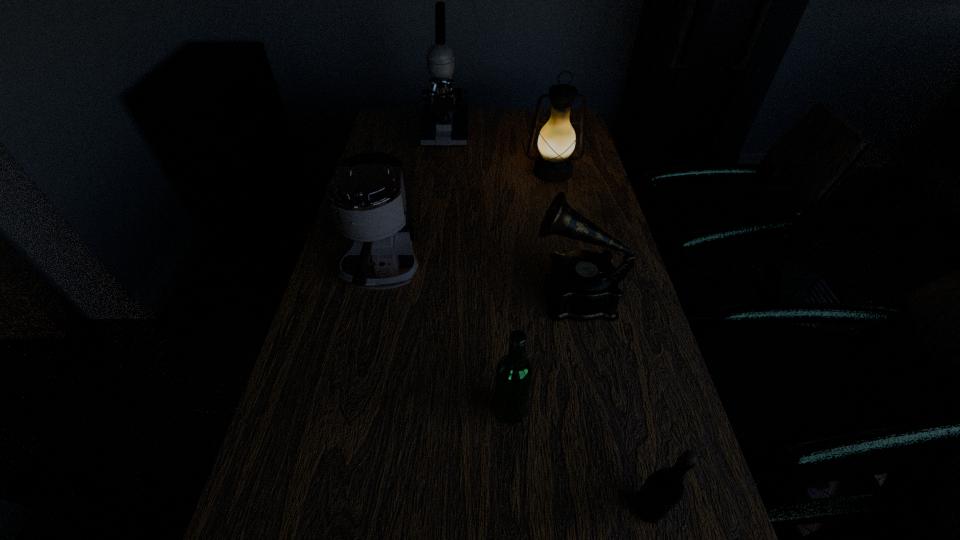
Find the location of a particular element. This screenshot has width=960, height=540. vacant space located 0.060m on the left of the oil lamp is located at coordinates (507, 172).

Image resolution: width=960 pixels, height=540 pixels. In order to click on vacant point located 0.330m on the front-facing side of the coffee maker in this screenshot , I will do [340, 467].

Find the location of a particular element. Image resolution: width=960 pixels, height=540 pixels. vacant area located on the horn of the phonograph record is located at coordinates (484, 295).

Where is `free space located on the horn of the phonograph record`? Image resolution: width=960 pixels, height=540 pixels. free space located on the horn of the phonograph record is located at coordinates (386, 295).

What are the coordinates of `free space located on the horn of the phonograph record` in the screenshot? It's located at (370, 295).

In order to click on vacant space situated on the back of the second nearest object in this screenshot , I will do `click(504, 287)`.

This screenshot has height=540, width=960. Identify the location of free space located on the back of the nearest object. (603, 323).

Where is `object at the far edge`? This screenshot has width=960, height=540. object at the far edge is located at coordinates (444, 122).

This screenshot has width=960, height=540. I want to click on object present at the left edge, so click(x=366, y=195).

At what (x,y) coordinates should I click in order to perform the action: click on oil lamp located in the right edge section of the desktop. Please return your answer as a coordinate pair (x, y). The width and height of the screenshot is (960, 540). Looking at the image, I should click on [x=556, y=142].